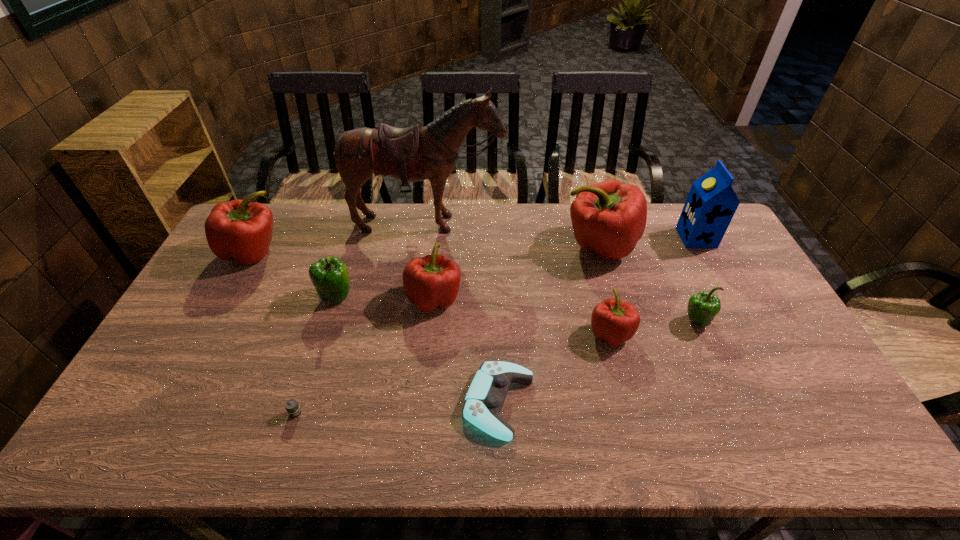
Where is `empty location between the shortest object and the second bell pepper from left to right`? empty location between the shortest object and the second bell pepper from left to right is located at coordinates (316, 354).

The height and width of the screenshot is (540, 960). I want to click on free spot between the second shortest object and the farther green bell pepper, so click(418, 349).

Locate an element on the screen. This screenshot has height=540, width=960. blank region between the beer can and the smallest pink bell pepper is located at coordinates (453, 373).

Where is `free spot between the brown saddle and the smallest pink bell pepper`? Image resolution: width=960 pixels, height=540 pixels. free spot between the brown saddle and the smallest pink bell pepper is located at coordinates (519, 279).

Identify the location of vacant space in between the third biggest pink bell pepper and the control. (467, 350).

At what (x,y) coordinates should I click in order to perform the action: click on vacant area that lies between the biggest pink bell pepper and the control. Please return your answer as a coordinate pair (x, y). The image size is (960, 540). Looking at the image, I should click on [549, 324].

What are the coordinates of `empty space between the nearer green bell pepper and the biggest pink bell pepper` in the screenshot? It's located at (648, 284).

Image resolution: width=960 pixels, height=540 pixels. Identify the location of vacant area that lies between the shortest object and the smallest pink bell pepper. (453, 373).

The image size is (960, 540). I want to click on unoccupied position between the control and the bigger green bell pepper, so click(x=418, y=349).

Locate an element on the screen. Image resolution: width=960 pixels, height=540 pixels. free area in between the bigger green bell pepper and the shortest object is located at coordinates tap(316, 354).